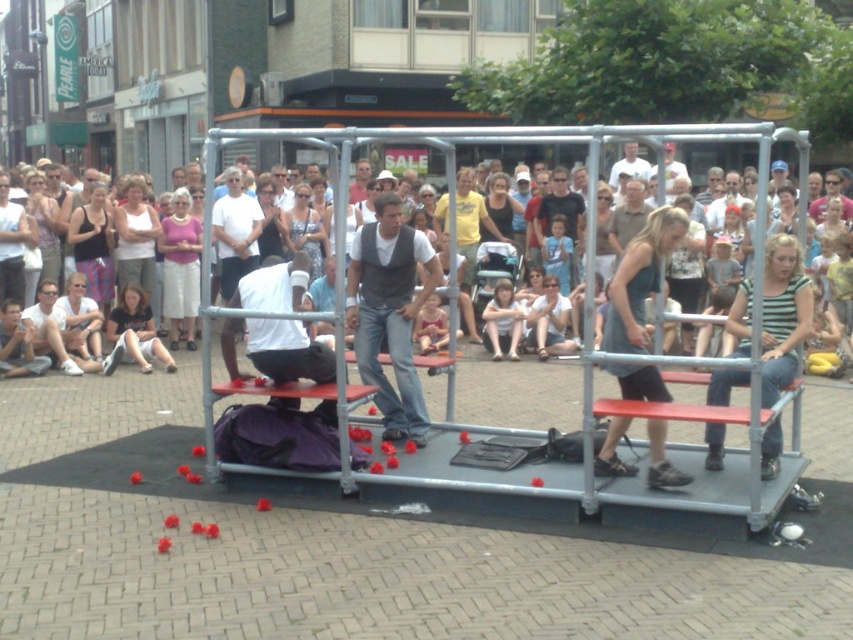
You are a costume designer preparing for a performance. You have two options for the performer at the center of the stage. Which clothing item is more formfitting, the white tank top at center or the matte gray vest at center?

The white tank top at center is thinner than the matte gray vest at center, so the white tank top at center is more formfitting.

You are a photographer standing at the edge of the square. You want to take a photo of both the white tank top at center and the matte gray vest at center in the same frame. Given that your camera has a maximum focal length that allows capturing objects up to 6 meters apart in a single shot, will you be able to include both in your photo?

The white tank top at center and the matte gray vest at center are 5.82 meters apart, which is within the camera maximum focal length of 6 meters. Therefore, you can include both in the same frame.